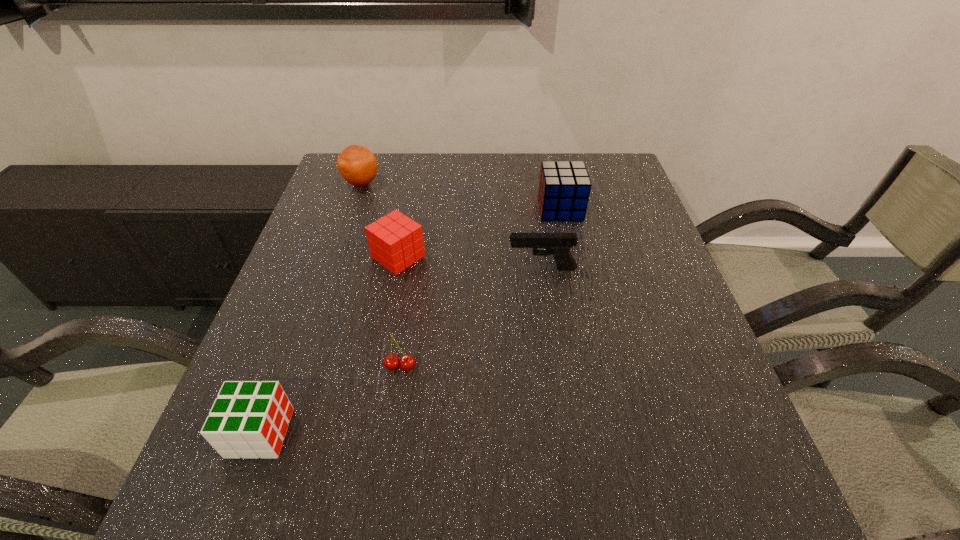
Find the location of a particular element. This screenshot has height=540, width=960. vacant space located 0.050m on the front-facing side of the pistol is located at coordinates (487, 268).

Image resolution: width=960 pixels, height=540 pixels. Find the location of `free spot located on the front-facing side of the pistol`. free spot located on the front-facing side of the pistol is located at coordinates (396, 268).

Find the location of `vacant space positioned 0.330m on the front-facing side of the pistol`. vacant space positioned 0.330m on the front-facing side of the pistol is located at coordinates (371, 268).

Image resolution: width=960 pixels, height=540 pixels. Identify the location of free spot located 0.100m on the left of the second farthest cube. (331, 256).

Where is `vacant space positioned on the red face of the leftmost cube`? The height and width of the screenshot is (540, 960). vacant space positioned on the red face of the leftmost cube is located at coordinates (510, 433).

You are a GUI agent. You are given a task and a screenshot of the screen. Output one action in this format:
    pyautogui.click(x=<x>, y=<y>)
    Task: Click on the vacant region located with the stems of the fifth farthest object pointing upwards
    
    Given the screenshot: What is the action you would take?
    pyautogui.click(x=380, y=507)

Identify the location of object present at the far edge. (358, 166).

Locate an element on the screen. The width and height of the screenshot is (960, 540). orange present at the left edge is located at coordinates (358, 166).

Find the location of a particular element. The height and width of the screenshot is (540, 960). cube that is positioned at the left edge is located at coordinates (249, 419).

Find the location of a particular element. Image resolution: width=960 pixels, height=540 pixels. object at the far left corner is located at coordinates (358, 166).